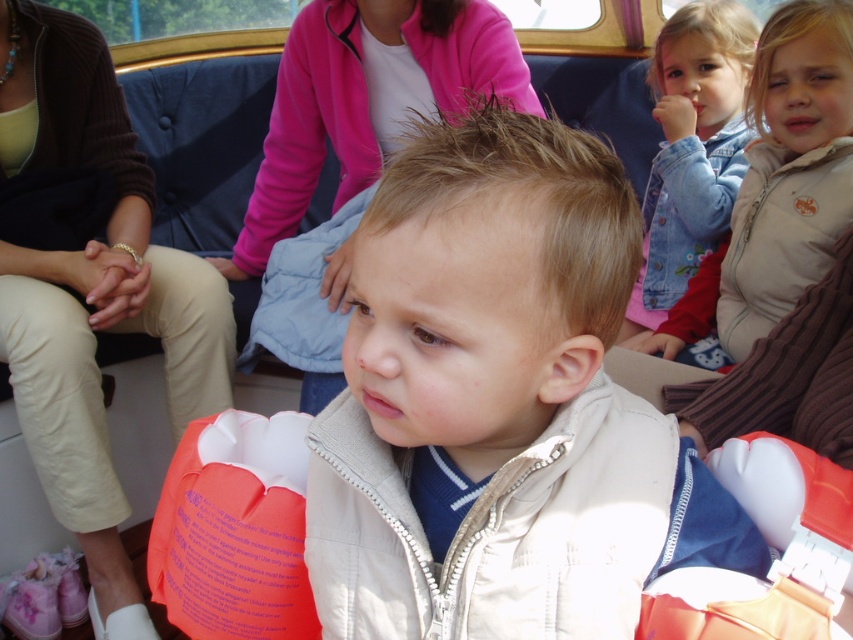
Consider the image. You are navigating a small boat and need to determine the position of two points marked on your map. The first point is labeled as point (474,545) and the second as point (692,13). According to the scene, which point is closer to the front of the boat?

Point (474,545) is closer to the front of the boat because it is in front of point (692,13).

You are a safety inspector checking the boat for proper life vest placement. According to the image, which life vest, the white matte vest at center or the orange life vest at lower left, is located to the right of the other?

The white matte vest at center is positioned on the right side of orange life vest at lower left.